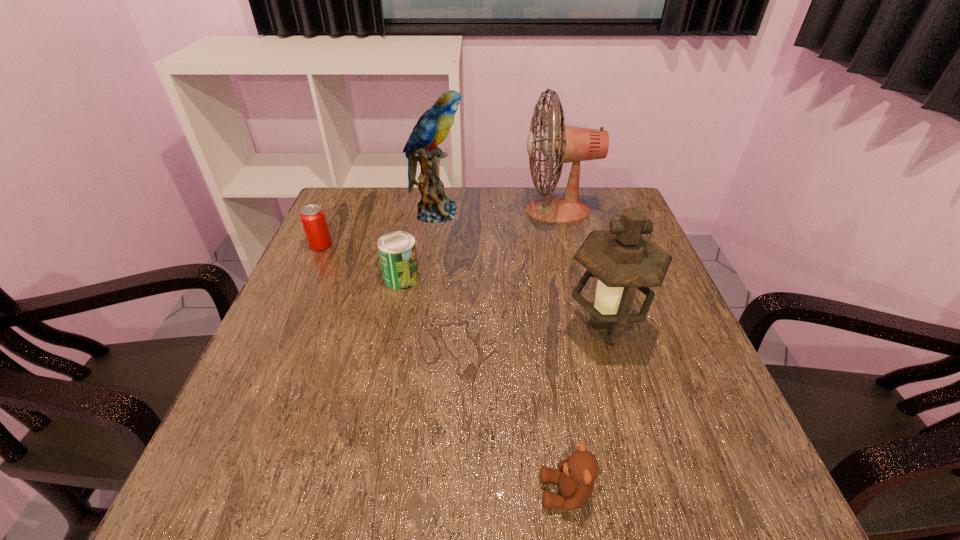
Locate an element on the screen. The height and width of the screenshot is (540, 960). fan that is at the far edge is located at coordinates (569, 144).

The height and width of the screenshot is (540, 960). Identify the location of object at the near edge. (576, 475).

This screenshot has width=960, height=540. Identify the location of object that is positioned at the left edge. (313, 219).

Find the location of a particular element. fan located in the right edge section of the desktop is located at coordinates (569, 144).

Locate an element on the screen. oil lamp present at the right edge is located at coordinates (623, 260).

I want to click on object present at the far right corner, so click(569, 144).

What are the coordinates of `vacant space at the far edge of the desktop` in the screenshot? It's located at pos(399,231).

The width and height of the screenshot is (960, 540). I want to click on vacant space at the left edge of the desktop, so click(x=303, y=399).

Where is `vacant region at the right edge of the desktop`? The height and width of the screenshot is (540, 960). vacant region at the right edge of the desktop is located at coordinates (651, 313).

I want to click on vacant space at the far right corner of the desktop, so click(x=619, y=192).